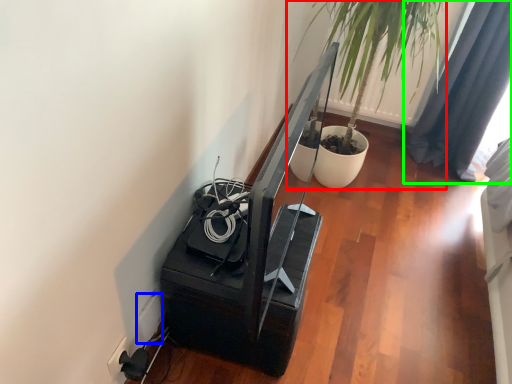
Question: Considering the real-world distances, which object is farthest from houseplant (highlighted by a red box)? electric outlet (highlighted by a blue box) or curtain (highlighted by a green box)?

Choices:
 (A) electric outlet
 (B) curtain

Answer: (A)